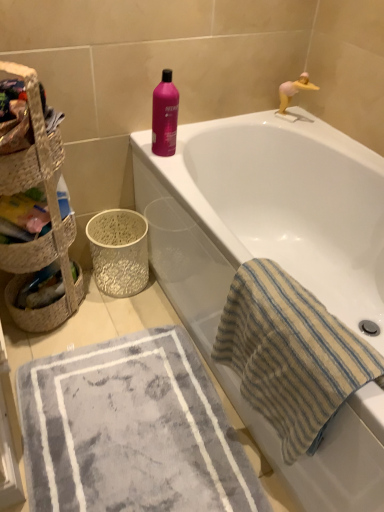
What are the coordinates of `free location in front of white textured basket at lower left, acting as the second basket container starting from the front` in the screenshot? It's located at [x=117, y=317].